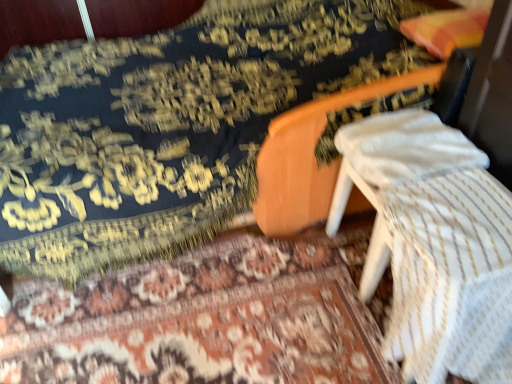
Measure the distance between point (x=78, y=381) and camera.

The distance of point (x=78, y=381) from camera is 3.84 feet.

What do you see at coordinates (200, 322) in the screenshot? This screenshot has width=512, height=384. I see `floral carpet at center` at bounding box center [200, 322].

Locate an element on the screen. The height and width of the screenshot is (384, 512). white cotton pillow at center is located at coordinates (405, 146).

Measure the distance between point (366,162) and camera.

3.73 feet.

What are the coordinates of `floral carpet at center` in the screenshot? It's located at (200, 322).

Which is less distant, (x=194, y=302) or (x=438, y=143)?

Point (x=194, y=302) is positioned farther from the camera compared to point (x=438, y=143).

This screenshot has width=512, height=384. I want to click on pillow above the floral carpet at center (from a real-world perspective), so click(405, 146).

Considering their positions, is floral carpet at center located in front of or behind white cotton pillow at center?

In the image, floral carpet at center appears in front of white cotton pillow at center.

Would you consider white cotton pillow at center to be distant from floral carpet at center?

No, white cotton pillow at center is not far from floral carpet at center.

Does white cotton pillow at center have a lesser height compared to floral carpet at center?

No, white cotton pillow at center is not shorter than floral carpet at center.

Is floral carpet at center inside white cotton pillow at center?

No, floral carpet at center is not surrounded by white cotton pillow at center.

Which is in front, white cotton pillow at center or floral carpet at center?

floral carpet at center is in front.

Does velvet-like dark blue mattress at center have a lesser height compared to white striped fabric at lower right?

No.

Consider the image. Does velvet-like dark blue mattress at center have a larger size compared to white striped fabric at lower right?

Indeed, velvet-like dark blue mattress at center has a larger size compared to white striped fabric at lower right.

Does velvet-like dark blue mattress at center appear on the left side of white striped fabric at lower right?

Yes, velvet-like dark blue mattress at center is to the left of white striped fabric at lower right.

Locate an element on the screen. This screenshot has height=384, width=512. mattress above the white striped fabric at lower right (from the image's perspective) is located at coordinates (169, 124).

Can you tell me how much white striped fabric at lower right and floral carpet at center differ in facing direction?

The facing directions of white striped fabric at lower right and floral carpet at center are 92.7 degrees apart.

Is white striped fabric at lower right oriented away from floral carpet at center?

That's not correct — white striped fabric at lower right is not looking away from floral carpet at center.

Can you confirm if white striped fabric at lower right is shorter than floral carpet at center?

In fact, white striped fabric at lower right may be taller than floral carpet at center.

How far apart are white striped fabric at lower right and floral carpet at center?

white striped fabric at lower right and floral carpet at center are 16.92 inches apart from each other.

Between velvet-like dark blue mattress at center and floral carpet at center, which one has more height?

velvet-like dark blue mattress at center.

From a real-world perspective, who is located higher, velvet-like dark blue mattress at center or floral carpet at center?

In real-world perspective, velvet-like dark blue mattress at center is above.

In the scene shown: Is velvet-like dark blue mattress at center oriented towards floral carpet at center?

No.

Is velvet-like dark blue mattress at center completely or partially outside of floral carpet at center?

Yes, velvet-like dark blue mattress at center is not within floral carpet at center.

Considering the relative positions of white cotton pillow at center and velvet-like dark blue mattress at center in the image provided, is white cotton pillow at center to the left of velvet-like dark blue mattress at center from the viewer's perspective?

In fact, white cotton pillow at center is to the right of velvet-like dark blue mattress at center.

From the image's perspective, which one is positioned lower, white cotton pillow at center or velvet-like dark blue mattress at center?

white cotton pillow at center appears lower in the image.

Is white cotton pillow at center placed right next to velvet-like dark blue mattress at center?

white cotton pillow at center is not next to velvet-like dark blue mattress at center, and they're not touching.

Which is behind, point (399, 137) or point (458, 141)?

The point (458, 141) is farther.

Could you tell me if white cotton pillow at center is facing white striped fabric at lower right?

No, white cotton pillow at center does not turn towards white striped fabric at lower right.

From a real-world perspective, is white cotton pillow at center beneath white striped fabric at lower right?

No, from a real-world perspective, white cotton pillow at center is not below white striped fabric at lower right.

In the scene shown: What's the angular difference between white cotton pillow at center and white striped fabric at lower right's facing directions?

The facing directions of white cotton pillow at center and white striped fabric at lower right are 0.333 degrees apart.

You are a GUI agent. You are given a task and a screenshot of the screen. Output one action in this format:
    pyautogui.click(x=<x>, y=<y>)
    Task: Click on the mat below the white cotton pillow at center (from the image's perspective)
    The image size is (512, 384).
    Given the screenshot: What is the action you would take?
    pyautogui.click(x=200, y=322)

I want to click on pillow above the floral carpet at center (from the image's perspective), so click(405, 146).

Which object lies further to the anchor point white striped fabric at lower right, floral carpet at center or velvet-like dark blue mattress at center?

Based on the image, velvet-like dark blue mattress at center appears to be further to white striped fabric at lower right.

When comparing their distances from floral carpet at center, does white striped fabric at lower right or velvet-like dark blue mattress at center seem further?

Based on the image, velvet-like dark blue mattress at center appears to be further to floral carpet at center.

Based on their spatial positions, is floral carpet at center or white striped fabric at lower right further from white cotton pillow at center?

The object further to white cotton pillow at center is floral carpet at center.

Considering their positions, is floral carpet at center positioned closer to white cotton pillow at center than velvet-like dark blue mattress at center?

Based on the image, velvet-like dark blue mattress at center appears to be nearer to white cotton pillow at center.

From the image, which object appears to be farther from white cotton pillow at center, white striped fabric at lower right or velvet-like dark blue mattress at center?

velvet-like dark blue mattress at center.

Which object lies nearer to the anchor point white striped fabric at lower right, floral carpet at center or white cotton pillow at center?

Based on the image, white cotton pillow at center appears to be nearer to white striped fabric at lower right.

When comparing their distances from velvet-like dark blue mattress at center, does floral carpet at center or white cotton pillow at center seem further?

The object further to velvet-like dark blue mattress at center is white cotton pillow at center.

Based on their spatial positions, is floral carpet at center or white striped fabric at lower right further from velvet-like dark blue mattress at center?

The object further to velvet-like dark blue mattress at center is white striped fabric at lower right.

The width and height of the screenshot is (512, 384). What are the coordinates of `pillow situated between floral carpet at center and white striped fabric at lower right from left to right` in the screenshot? It's located at (405, 146).

Locate an element on the screen. The image size is (512, 384). furniture between velvet-like dark blue mattress at center and floral carpet at center in the up-down direction is located at coordinates (434, 244).

Where is `pillow between velvet-like dark blue mattress at center and floral carpet at center in the up-down direction`? pillow between velvet-like dark blue mattress at center and floral carpet at center in the up-down direction is located at coordinates point(405,146).

Locate an element on the screen. The image size is (512, 384). pillow between velvet-like dark blue mattress at center and white striped fabric at lower right in the vertical direction is located at coordinates (405, 146).